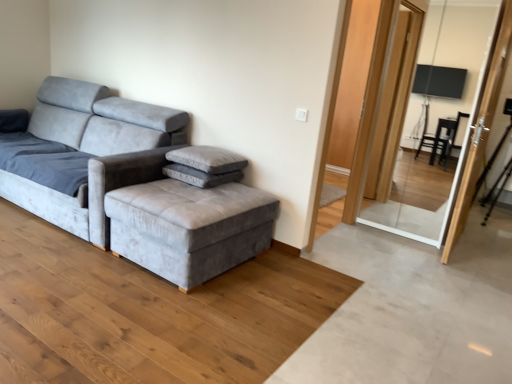
Image resolution: width=512 pixels, height=384 pixels. In order to click on free area in between matte black screen door at upper right, which is counted as the second screen door, starting from the left, and transparent glass screen door at upper right, the second screen door from the right in this screenshot , I will do `click(408, 240)`.